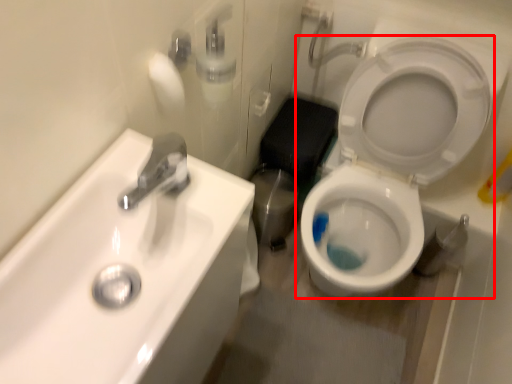
Question: From the image's perspective, where is toilet (annotated by the red box) located in relation to sink in the image?

Choices:
 (A) above
 (B) below

Answer: (A)